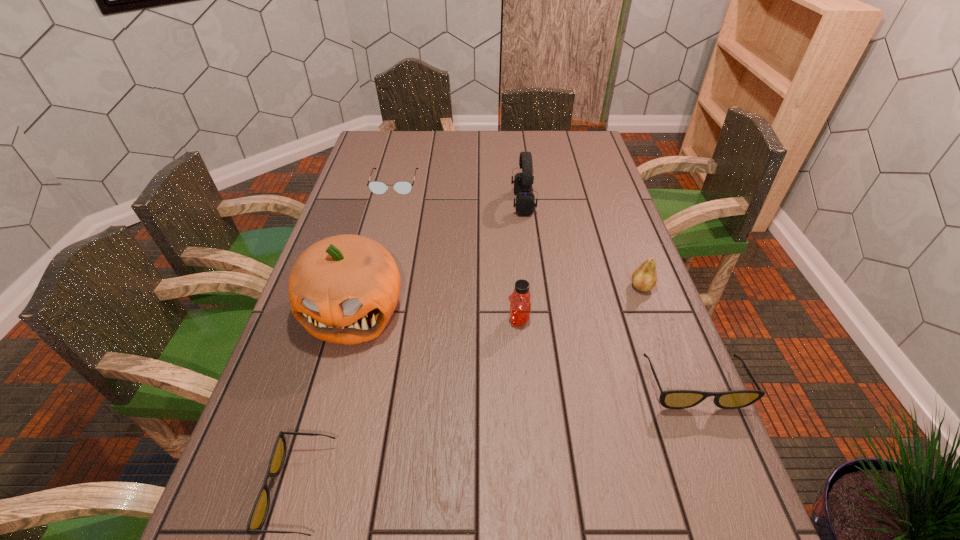
Find the location of `the right sunglasses`. the right sunglasses is located at coordinates (672, 399).

Where is `the taller sunglasses`? The image size is (960, 540). the taller sunglasses is located at coordinates (672, 399).

Locate an element on the screen. pumpkin is located at coordinates (343, 289).

This screenshot has width=960, height=540. Find the location of `spectacles`. spectacles is located at coordinates (402, 187).

This screenshot has width=960, height=540. Identify the location of headset. (525, 200).

You are a GUI agent. You are given a task and a screenshot of the screen. Output one action in this format:
    pyautogui.click(x=<x>, y=<y>)
    Task: Click on the honey
    Image resolution: width=960 pixels, height=540 pixels.
    Given the screenshot: What is the action you would take?
    pyautogui.click(x=520, y=307)

You are a GUI agent. You are given a task and a screenshot of the screen. Output one action in this format:
    pyautogui.click(x=<x>, y=<y>)
    Task: Click on the pear
    
    Given the screenshot: What is the action you would take?
    (x=644, y=278)

Identify the location of vacant space located 0.170m on the front-facing side of the taller sunglasses. Image resolution: width=960 pixels, height=540 pixels. (737, 494).

Locate an element on the screen. The width and height of the screenshot is (960, 540). vacant space situated 0.330m on the face of the pumpkin is located at coordinates [301, 502].

I want to click on free spot located 0.290m on the lenses of the spectacles, so click(x=377, y=250).